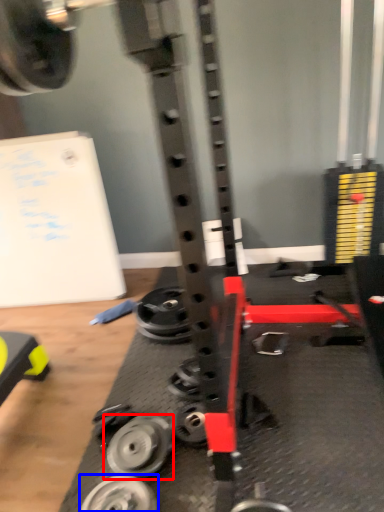
Question: Which point is closer to the camera, wheel (highlighted by a red box) or wheel (highlighted by a blue box)?

Choices:
 (A) wheel
 (B) wheel

Answer: (B)